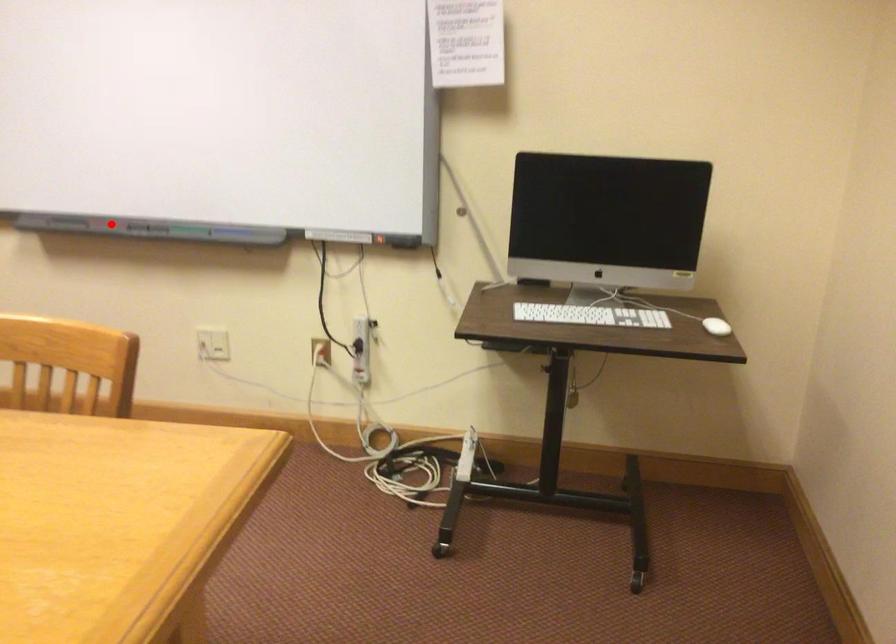
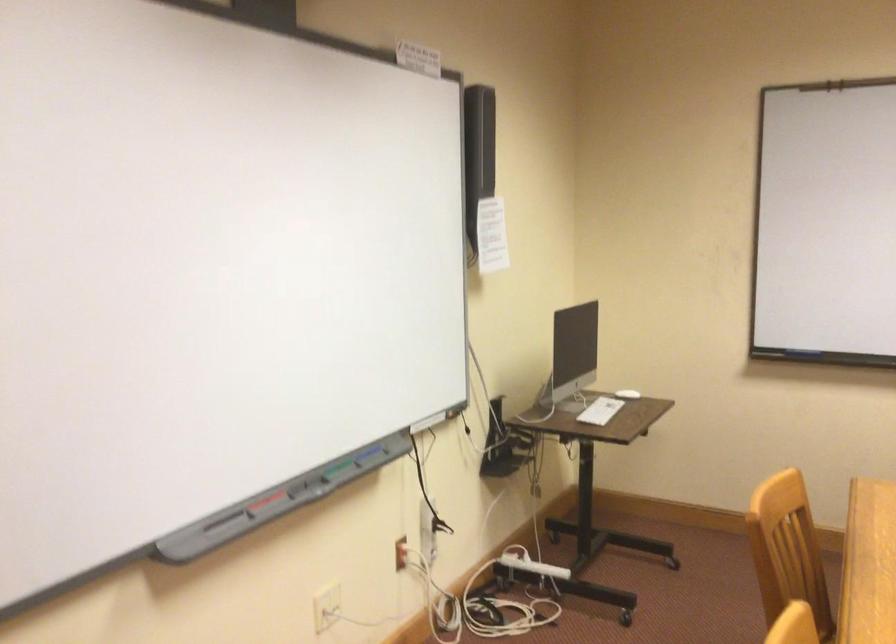
Question: I am providing you with two images of the same scene from different viewpoints. In image1, a red point is highlighted. Considering the same 3D point in image2, which of the following is correct?

Choices:
 (A) It is closer
 (B) It is farther

Answer: (A)